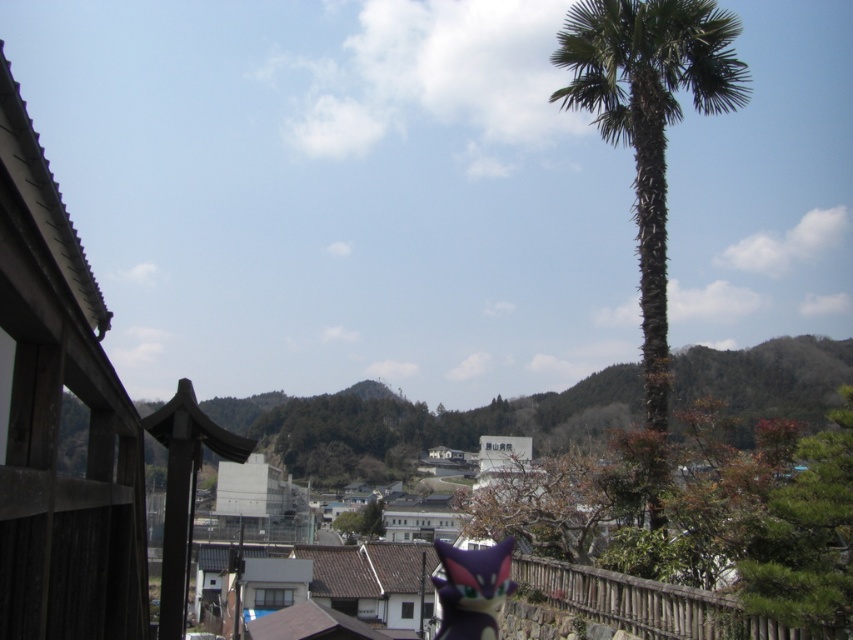
You are standing at the viewpoint overlooking the town and want to take a photo that includes both the wooden structure with the purple fox and the white building with signage. Based on their positions, which of the two points, point 1 at (643, 218) or point 2 at (503, 577), should you focus on to ensure both structures are in focus?

Point 1 at (643, 218) is further to the camera than point 2 at (503, 577). To ensure both structures are in focus, you should focus on the point that is closer to the camera, which is point 2 at (503, 577). This way, the depth of field will cover both the nearer and farther points.

You are a tourist standing in the village and want to take a photo that includes both the green leafy palm at right and the purple matte plush toy at center. Which object should you position closer to the camera to ensure both are in focus?

Result: The green leafy palm at right is further to the viewer than the purple matte plush toy at center. To ensure both are in focus, position the camera so that the green leafy palm at right is closer to the lens since it is nearer to the viewer compared to the purple matte plush toy at center.